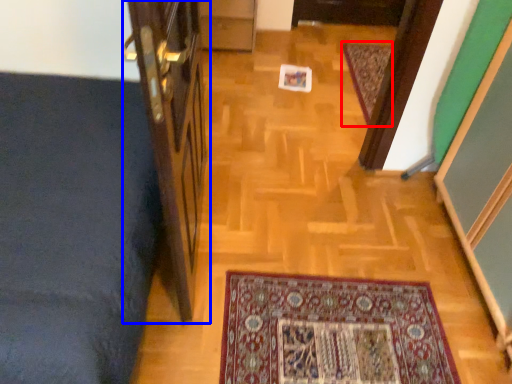
Question: Which point is closer to the camera, mat (highlighted by a red box) or door (highlighted by a blue box)?

Choices:
 (A) mat
 (B) door

Answer: (B)